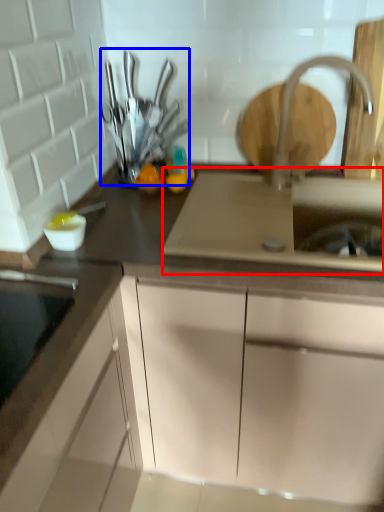
Question: Which object is further to the camera taking this photo, sink (highlighted by a red box) or tableware (highlighted by a blue box)?

Choices:
 (A) sink
 (B) tableware

Answer: (B)